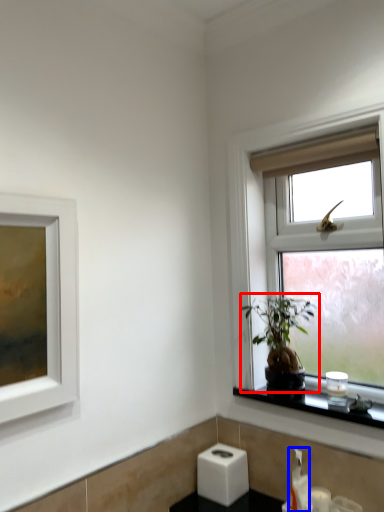
Question: Which point is further to the camera, houseplant (highlighted by a red box) or soap dispenser (highlighted by a blue box)?

Choices:
 (A) houseplant
 (B) soap dispenser

Answer: (B)